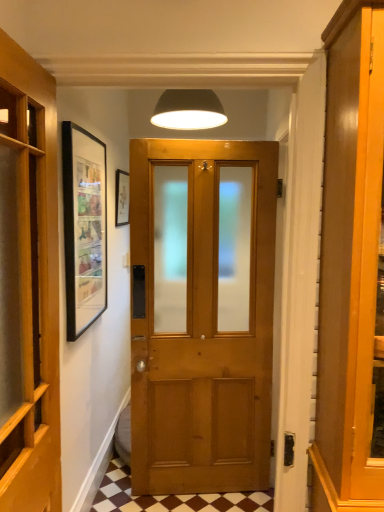
This screenshot has height=512, width=384. I want to click on white matte lampshade at upper center, so click(x=188, y=110).

Measure the distance between point (206, 113) and camera.

Point (206, 113) and camera are 2.29 meters apart.

Locate an element on the screen. Image resolution: width=384 pixels, height=512 pixels. wooden door at left is located at coordinates (33, 285).

Image resolution: width=384 pixels, height=512 pixels. Describe the element at coordinates (171, 497) in the screenshot. I see `brown checkered tile at center` at that location.

Locate an element on the screen. The image size is (384, 512). white matte lampshade at upper center is located at coordinates (188, 110).

From a real-world perspective, is matte black picture frame at upper left positioned above or below white matte lampshade at upper center?

matte black picture frame at upper left is situated lower than white matte lampshade at upper center in the real world.

Is matte black picture frame at upper left beside white matte lampshade at upper center?

They are not placed beside each other.

Is matte black picture frame at upper left smaller than white matte lampshade at upper center?

Yes, matte black picture frame at upper left is smaller than white matte lampshade at upper center.

Can you tell me how much matte black picture frame at upper left and white matte lampshade at upper center differ in facing direction?

There is a 84.9-degree angle between the facing directions of matte black picture frame at upper left and white matte lampshade at upper center.

Is matte black picture frame at upper left surrounded by white matte lampshade at upper center?

No, matte black picture frame at upper left is not a part of white matte lampshade at upper center.

Considering the sizes of white matte lampshade at upper center and matte black picture frame at upper left in the image, is white matte lampshade at upper center bigger or smaller than matte black picture frame at upper left?

In the image, white matte lampshade at upper center appears to be larger than matte black picture frame at upper left.

You are a GUI agent. You are given a task and a screenshot of the screen. Output one action in this format:
    pyautogui.click(x=<x>, y=<y>)
    Task: Click on the picture frame located behind the white matte lampshade at upper center
    
    Given the screenshot: What is the action you would take?
    pyautogui.click(x=122, y=198)

Considering the sizes of white matte lampshade at upper center and wooden door at left in the image, is white matte lampshade at upper center taller or shorter than wooden door at left?

In the image, white matte lampshade at upper center appears to be shorter than wooden door at left.

From the image's perspective, between white matte lampshade at upper center and wooden door at left, which one is located above?

white matte lampshade at upper center is shown above in the image.

What's the angular difference between white matte lampshade at upper center and wooden door at left's facing directions?

white matte lampshade at upper center and wooden door at left are facing 87.2 degrees away from each other.

Is white matte lampshade at upper center positioned beyond the bounds of wooden door at left?

Yes, white matte lampshade at upper center is not within wooden door at left.

From a real-world perspective, is wooden door at left located higher than matte black picture frame at upper left?

Incorrect, from a real-world perspective, wooden door at left is lower than matte black picture frame at upper left.

Which is in front, point (3, 134) or point (120, 194)?

The point (3, 134) is more forward.

In the image, is wooden door at left on the left side or the right side of matte black picture frame at upper left?

From the image, it's evident that wooden door at left is to the left of matte black picture frame at upper left.

The width and height of the screenshot is (384, 512). I want to click on door lying below the matte black picture frame at upper left (from the image's perspective), so click(33, 285).

What are the coordinates of `picture frame that appears behind the brown checkered tile at center` in the screenshot? It's located at (122, 198).

Is matte black picture frame at upper left taller than brown checkered tile at center?

Yes, matte black picture frame at upper left is taller than brown checkered tile at center.

Is matte black picture frame at upper left far from brown checkered tile at center?

Yes, matte black picture frame at upper left and brown checkered tile at center are located far from each other.

Is matte black picture frame at upper left not within brown checkered tile at center?

Indeed, matte black picture frame at upper left is completely outside brown checkered tile at center.

Is matte black picture frame at upper left taller than wooden door at left?

Incorrect, the height of matte black picture frame at upper left is not larger of that of wooden door at left.

Would you say matte black picture frame at upper left is to the left or to the right of wooden door at left in the picture?

matte black picture frame at upper left is to the right of wooden door at left.

Considering the sizes of objects matte black picture frame at upper left and wooden door at left in the image provided, who is wider, matte black picture frame at upper left or wooden door at left?

Wider between the two is wooden door at left.

Choose the correct answer: Is matte black picture frame at upper left inside wooden door at left or outside it?

The correct answer is: outside.

Between brown checkered tile at center and wooden door at left, which one has smaller size?

brown checkered tile at center.

Which is correct: brown checkered tile at center is inside wooden door at left, or outside of it?

brown checkered tile at center is located beyond the bounds of wooden door at left.

Between brown checkered tile at center and wooden door at left, which one is positioned in front?

wooden door at left is closer to the camera.

Does brown checkered tile at center have a lesser height compared to wooden door at left?

Yes.

Identify the location of lamp that appears in front of the matte black picture frame at upper left. This screenshot has width=384, height=512. (188, 110).

Find the location of a particular element. picture frame that appears below the white matte lampshade at upper center (from the image's perspective) is located at coordinates (122, 198).

From the image, which object appears to be farther from matte black picture frame at upper left, white matte lampshade at upper center or brown checkered tile at center?

Among the two, brown checkered tile at center is located further to matte black picture frame at upper left.

Consider the image. Estimate the real-world distances between objects in this image. Which object is closer to matte black picture frame at upper left, wooden door at left or brown checkered tile at center?

The object closer to matte black picture frame at upper left is wooden door at left.

When comparing their distances from matte black picture frame at upper left, does brown checkered tile at center or wooden door at left seem closer?

wooden door at left.

Estimate the real-world distances between objects in this image. Which object is closer to wooden door at left, white matte lampshade at upper center or matte black picture frame at upper left?

white matte lampshade at upper center is positioned closer to the anchor wooden door at left.

Looking at the image, which one is located closer to matte black picture frame at upper left, brown checkered tile at center or white matte lampshade at upper center?

Based on the image, white matte lampshade at upper center appears to be nearer to matte black picture frame at upper left.

From the image, which object appears to be nearer to white matte lampshade at upper center, brown checkered tile at center or matte black picture frame at upper left?

matte black picture frame at upper left is closer to white matte lampshade at upper center.

From the image, which object appears to be nearer to brown checkered tile at center, wooden door at left or white matte lampshade at upper center?

wooden door at left is closer to brown checkered tile at center.

From the image, which object appears to be nearer to brown checkered tile at center, white matte lampshade at upper center or wooden door at left?

wooden door at left lies closer to brown checkered tile at center than the other object.

Locate an element on the screen. This screenshot has height=512, width=384. lamp between wooden door at left and matte black picture frame at upper left along the z-axis is located at coordinates (188, 110).

Identify the location of tile between wooden door at left and matte black picture frame at upper left in the front-back direction. The width and height of the screenshot is (384, 512). (171, 497).

You are a GUI agent. You are given a task and a screenshot of the screen. Output one action in this format:
    pyautogui.click(x=<x>, y=<y>)
    Task: Click on the picture frame between white matte lampshade at upper center and brown checkered tile at center from top to bottom
    
    Given the screenshot: What is the action you would take?
    pyautogui.click(x=122, y=198)

Locate an element on the screen. door between white matte lampshade at upper center and brown checkered tile at center in the up-down direction is located at coordinates (33, 285).